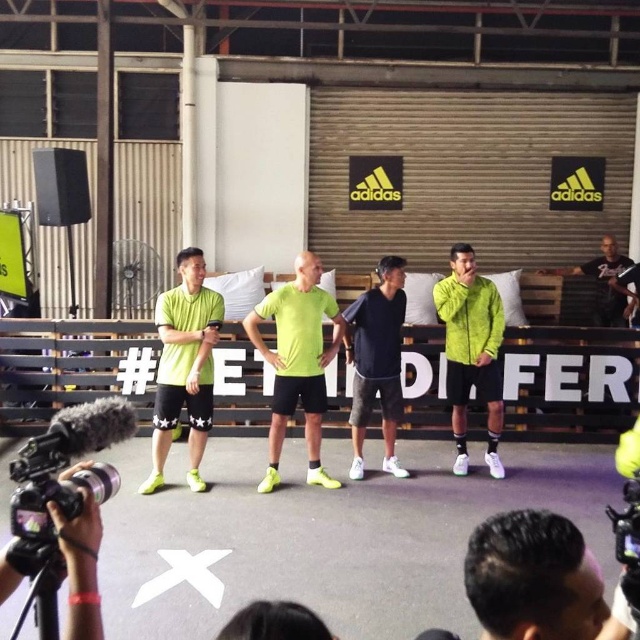
Question: Among these objects, which one is nearest to the camera?

Choices:
 (A) neon green fabric shirt at center
 (B) dark brown hair at center
 (C) matte green shorts at center

Answer: (B)

Question: Is dark blue jersey at center above matte black camera at lower left?

Choices:
 (A) no
 (B) yes

Answer: (B)

Question: Considering the relative positions of matte green shorts at center and neon green fabric jacket at center in the image provided, where is matte green shorts at center located with respect to neon green fabric jacket at center?

Choices:
 (A) right
 (B) left

Answer: (B)

Question: Is dark brown hair at center to the left of dark blue jersey at center from the viewer's perspective?

Choices:
 (A) no
 (B) yes

Answer: (A)

Question: Which point is farther to the camera?

Choices:
 (A) (161, 460)
 (B) (70, 538)
 (C) (589, 554)

Answer: (A)

Question: Among these points, which one is nearest to the camera?

Choices:
 (A) (598, 257)
 (B) (349, 477)
 (C) (177, 412)

Answer: (C)